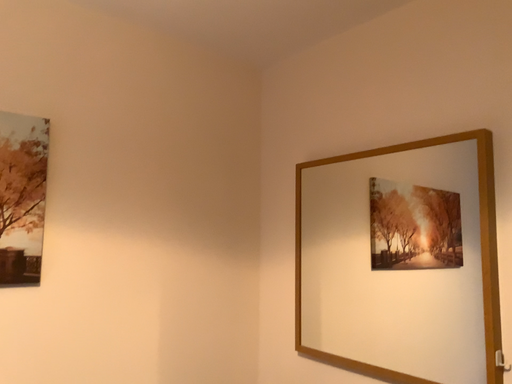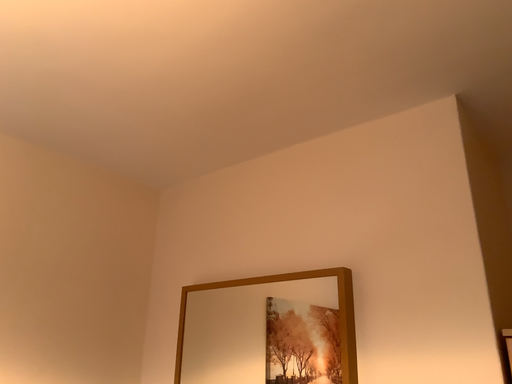
Question: Which way did the camera rotate in the video?

Choices:
 (A) rotated downward
 (B) rotated upward

Answer: (B)